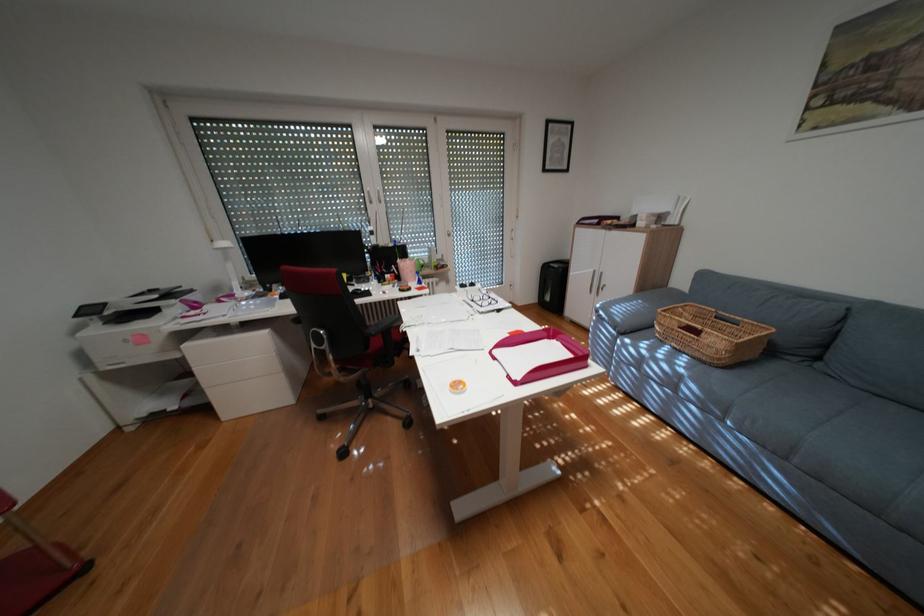
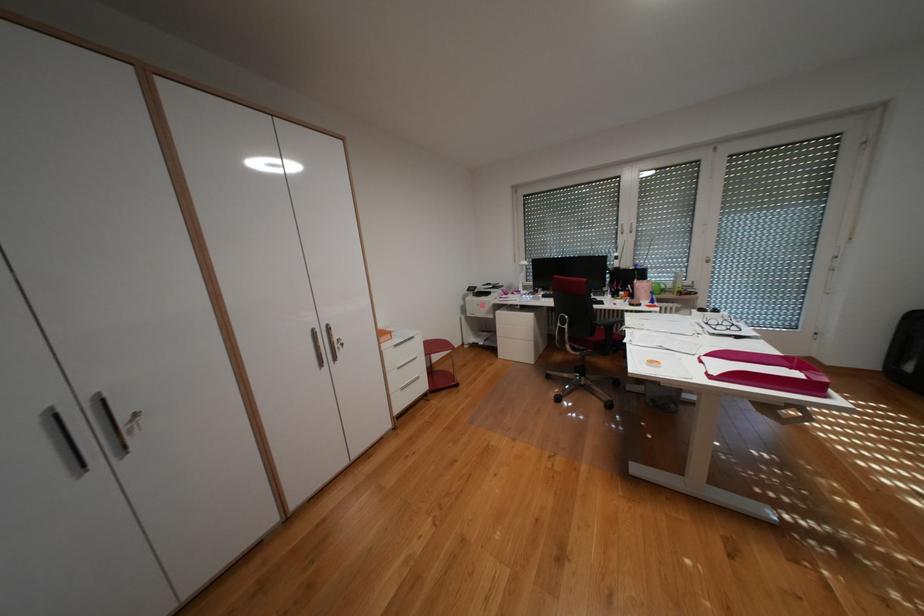
Where in the second image is the point corresponding to point 379,326 from the first image?

(608, 318)